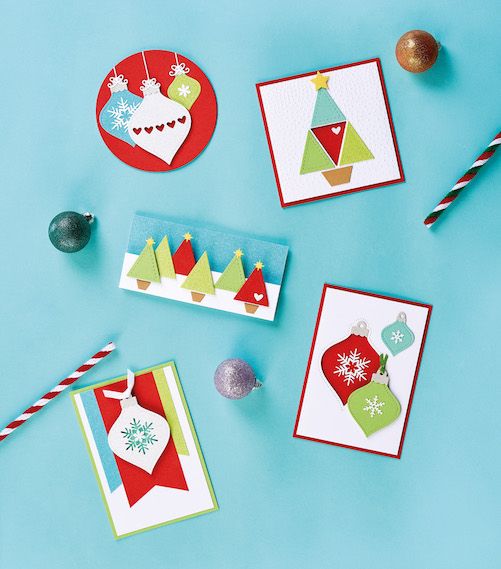
The height and width of the screenshot is (569, 501). What are the coordinates of `sheet` in the screenshot? It's located at (338, 224).